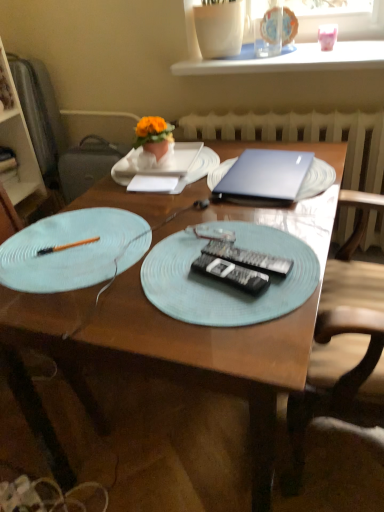
At what (x,y) coordinates should I click in order to perform the action: click on vacant area located to the right-hand side of white paper at center. Please return your answer as a coordinate pair (x, y). The height and width of the screenshot is (512, 384). Looking at the image, I should click on (203, 183).